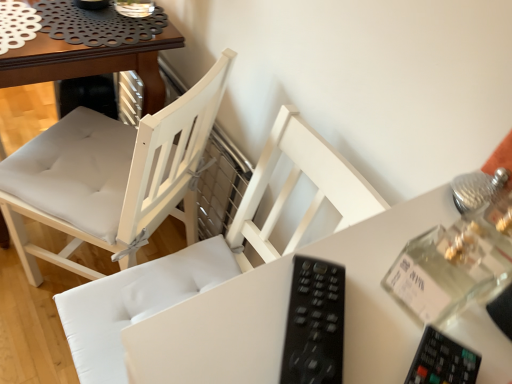
Question: Can you confirm if white wood chair at center, placed as the second chair when sorted from left to right, is shorter than black plastic remote at center?

Choices:
 (A) yes
 (B) no

Answer: (B)

Question: Considering the relative sizes of white wood chair at center, placed as the second chair when sorted from left to right, and black plastic remote at center in the image provided, is white wood chair at center, placed as the second chair when sorted from left to right, thinner than black plastic remote at center?

Choices:
 (A) no
 (B) yes

Answer: (A)

Question: Is white wood chair at center, placed as the second chair when sorted from left to right, oriented away from black plastic remote at center?

Choices:
 (A) yes
 (B) no

Answer: (B)

Question: Is white wood chair at center, which ranks as the 1th chair in right-to-left order, located outside black plastic remote at center?

Choices:
 (A) no
 (B) yes

Answer: (B)

Question: Is white wood chair at center, which ranks as the 1th chair in right-to-left order, at the right side of black plastic remote at center?

Choices:
 (A) no
 (B) yes

Answer: (A)

Question: From a real-world perspective, is white fabric chair at center, which ranks as the first chair in left-to-right order, positioned above or below black plastic remote at center?

Choices:
 (A) below
 (B) above

Answer: (A)

Question: Does point pos(115,251) appear closer or farther from the camera than point pos(344,294)?

Choices:
 (A) farther
 (B) closer

Answer: (A)

Question: Considering the positions of white fabric chair at center, which ranks as the first chair in left-to-right order, and black plastic remote at center in the image, is white fabric chair at center, which ranks as the first chair in left-to-right order, wider or thinner than black plastic remote at center?

Choices:
 (A) wide
 (B) thin

Answer: (A)

Question: From the image's perspective, is white fabric chair at center, which ranks as the first chair in left-to-right order, positioned above or below black plastic remote at center?

Choices:
 (A) above
 (B) below

Answer: (A)

Question: Visually, is black plastic remote at center positioned to the left or to the right of white fabric chair at center, the 2th chair from the right?

Choices:
 (A) left
 (B) right

Answer: (B)

Question: From the image's perspective, relative to white fabric chair at center, which ranks as the first chair in left-to-right order, is black plastic remote at center above or below?

Choices:
 (A) below
 (B) above

Answer: (A)

Question: From their relative heights in the image, would you say black plastic remote at center is taller or shorter than white fabric chair at center, the 2th chair from the right?

Choices:
 (A) tall
 (B) short

Answer: (B)

Question: Is black plastic remote at center in front of or behind white fabric chair at center, the 2th chair from the right, in the image?

Choices:
 (A) behind
 (B) front

Answer: (B)

Question: Which is correct: white wood chair at center, placed as the second chair when sorted from left to right, is inside black plastic remote at center, or outside of it?

Choices:
 (A) inside
 (B) outside

Answer: (B)

Question: Is white wood chair at center, which ranks as the 1th chair in right-to-left order, in front of or behind black plastic remote at center in the image?

Choices:
 (A) front
 (B) behind

Answer: (B)